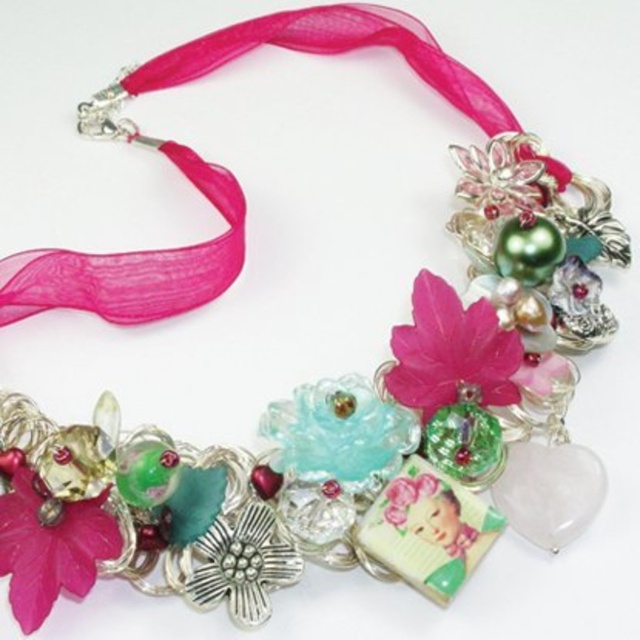
Question: Which point is farther to the camera?

Choices:
 (A) translucent green flower at center
 (B) matte pink flower at center
 (C) translucent plastic flower at center
 (D) pink glossy flower at center

Answer: (D)

Question: Among these points, which one is nearest to the camera?

Choices:
 (A) (422, 326)
 (B) (60, 576)
 (C) (522, 160)
 (D) (424, 481)

Answer: (B)

Question: Can you confirm if matte pink flower at center is wider than pink glossy flower at center?

Choices:
 (A) yes
 (B) no

Answer: (A)

Question: Is matte pink flower at center above translucent green flower at center?

Choices:
 (A) no
 (B) yes

Answer: (B)

Question: Which point is closer to the camera taking this photo?

Choices:
 (A) (424, 328)
 (B) (6, 547)
 (C) (422, 483)
 (D) (544, 189)

Answer: (B)

Question: Can you confirm if matte pink flower at center is positioned below pink glossy flower at center?

Choices:
 (A) yes
 (B) no

Answer: (A)